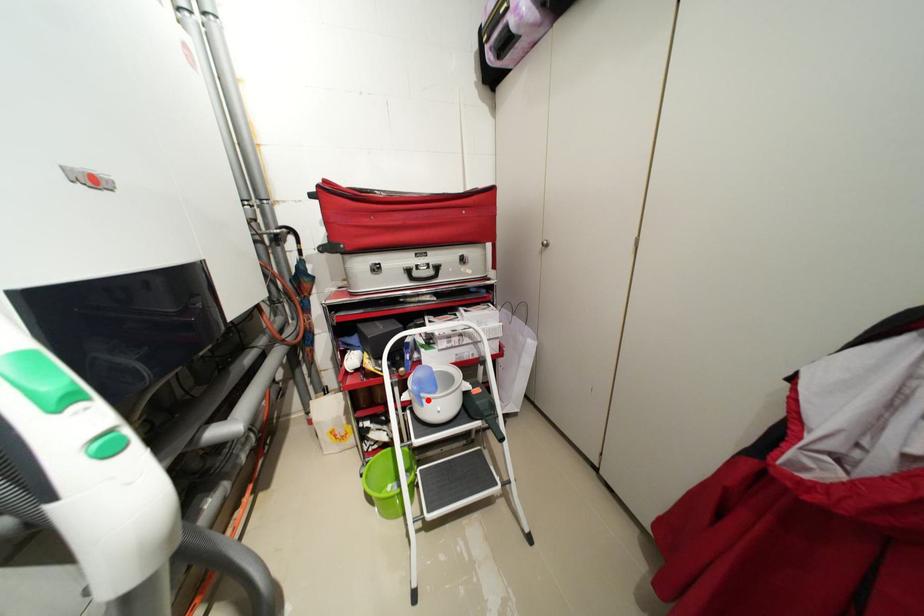
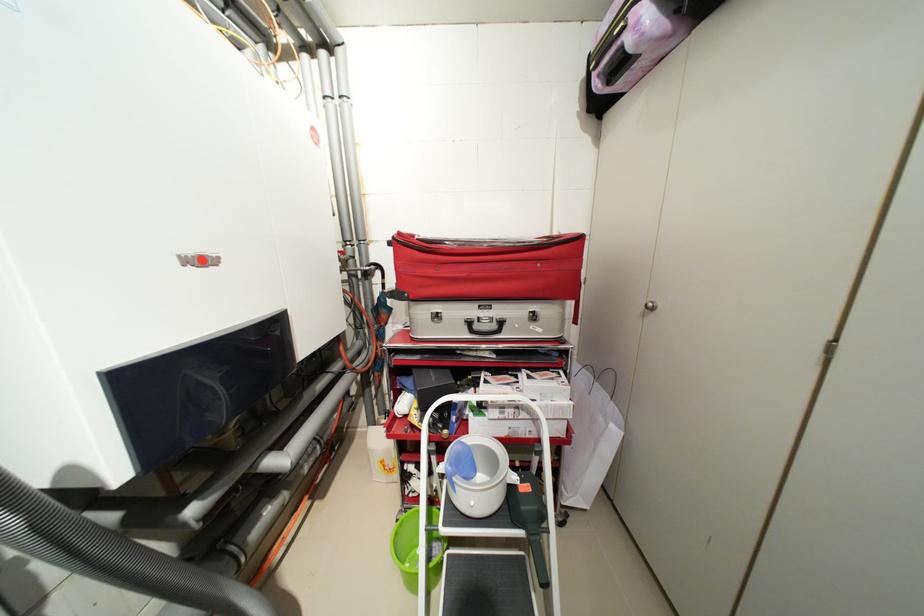
Where in the second image is the point corresponding to the highlighted location from the first image?

(459, 485)